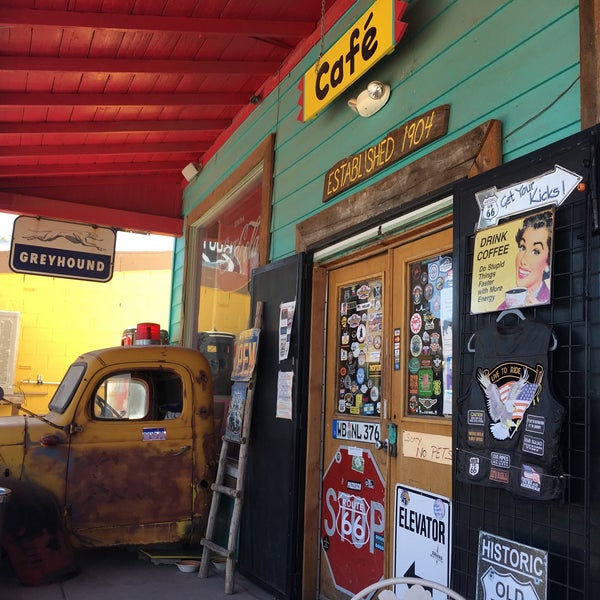
In order to click on door in this screenshot , I will do `click(393, 482)`.